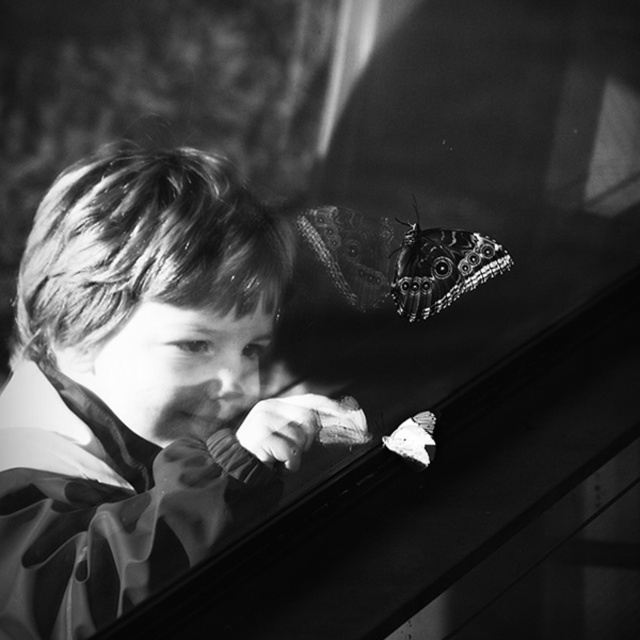
You are a photographer who wants to capture a closeup of the patterned wing butterfly at upper right. You are currently standing 1.20 meters away from the butterfly. Can you get closer to take the photo without moving the camera?

The patterned wing butterfly at upper right and camera are 1.20 meters apart. Since you are already at the same distance as the camera, you cannot get any closer without moving the camera.

You are a photographer who wants to capture the child and the butterflies in the scene. The child is at point (x=138, y=385). Where should you position your camera to ensure both the child and the butterflies are in focus?

The smooth fabric child at center is located at point (x=138, y=385). To ensure both the child and the butterflies are in focus, position the camera so that the focal point is at the child, as they are the main subject and the butterflies are in the foreground, their proximity to the child will keep them in focus.